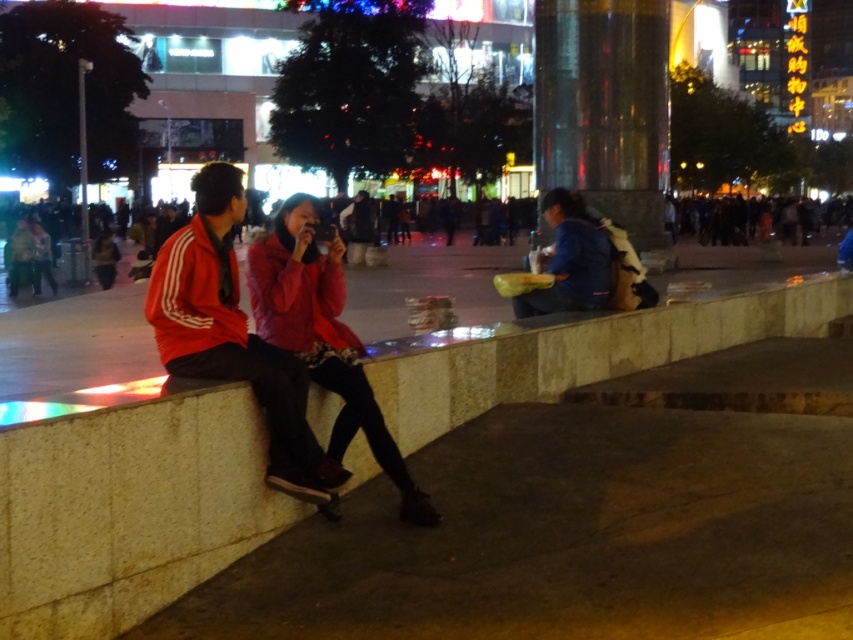
Find the location of a particular element. transparent glass pillar at center is located at coordinates (604, 108).

Which is above, transparent glass pillar at center or blue fabric bag at center?

transparent glass pillar at center

Image resolution: width=853 pixels, height=640 pixels. What do you see at coordinates (604, 108) in the screenshot?
I see `transparent glass pillar at center` at bounding box center [604, 108].

Where is `transparent glass pillar at center`? transparent glass pillar at center is located at coordinates (604, 108).

Does transparent glass pillar at center come behind red matte jacket at left?

Yes, transparent glass pillar at center is further from the viewer.

This screenshot has width=853, height=640. What do you see at coordinates (604, 108) in the screenshot? I see `transparent glass pillar at center` at bounding box center [604, 108].

Identify the location of transparent glass pillar at center. The height and width of the screenshot is (640, 853). (604, 108).

In the scene shown: Can you confirm if red matte jacket at left is positioned to the left of blue fabric bag at center?

Correct, you'll find red matte jacket at left to the left of blue fabric bag at center.

Between point (219, 272) and point (561, 216), which one is positioned in front?

Point (219, 272) is in front.

Who is more forward, (x=230, y=168) or (x=567, y=291)?

Point (x=230, y=168) is in front.

The width and height of the screenshot is (853, 640). Find the location of `red matte jacket at left`. red matte jacket at left is located at coordinates coord(231,333).